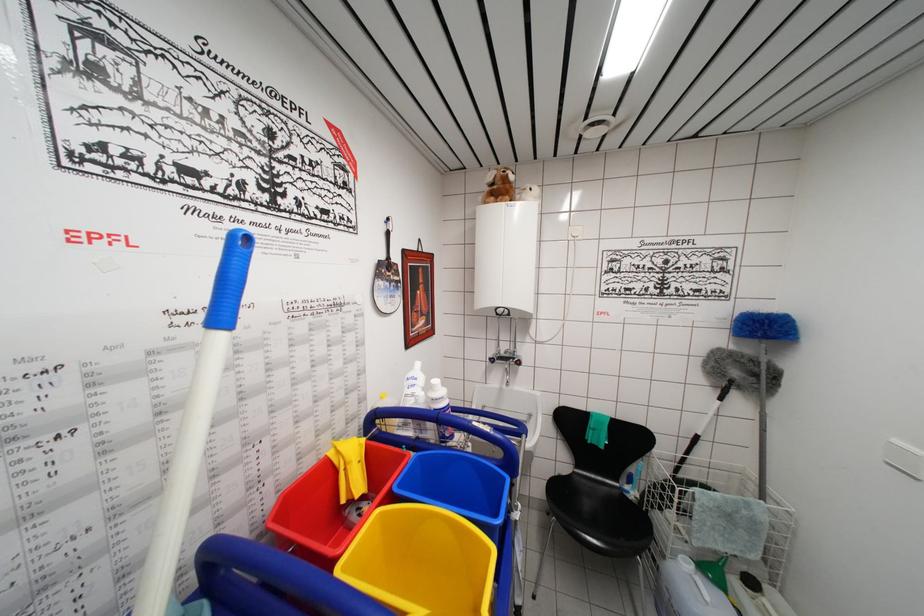
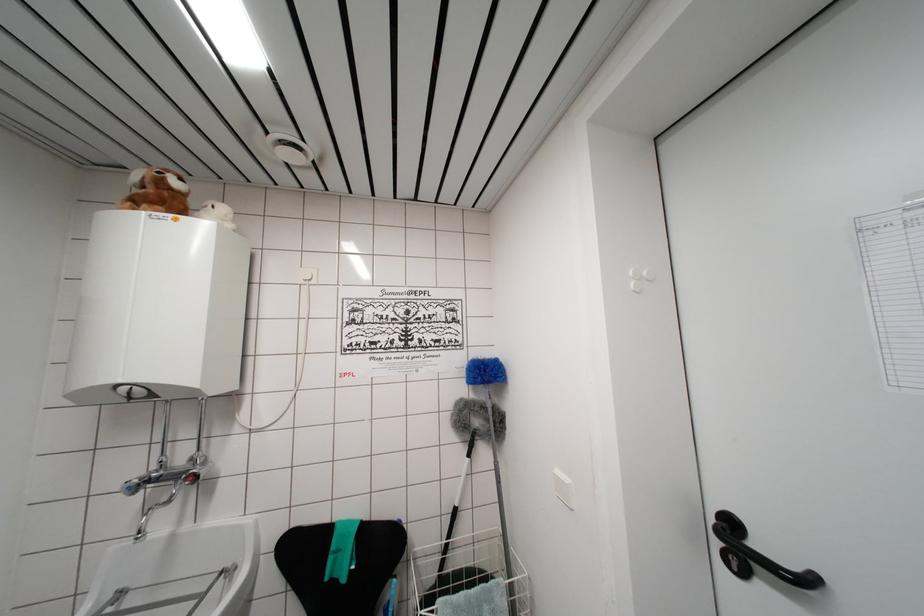
Where in the second image is the point corresponding to pixel 512 199 from the first image?

(168, 209)